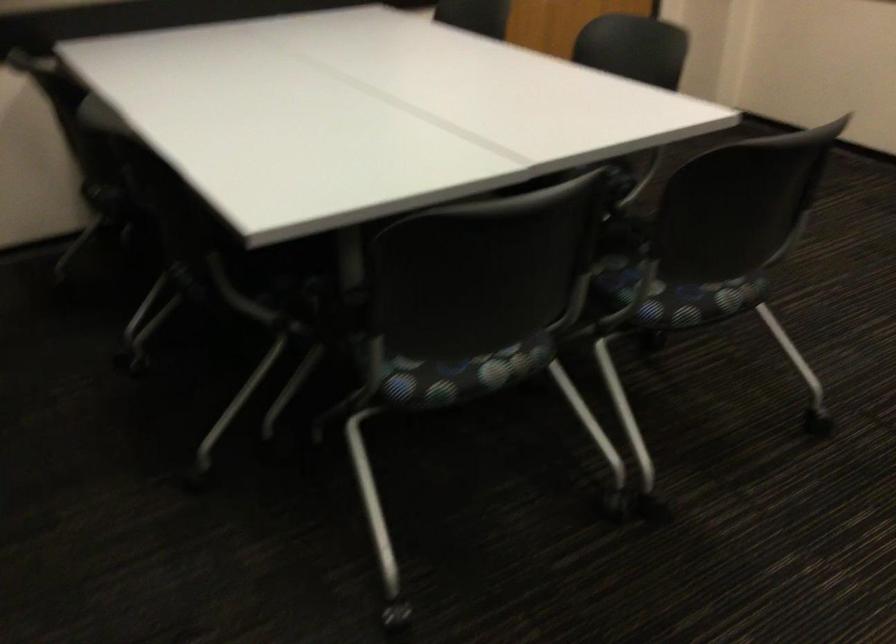
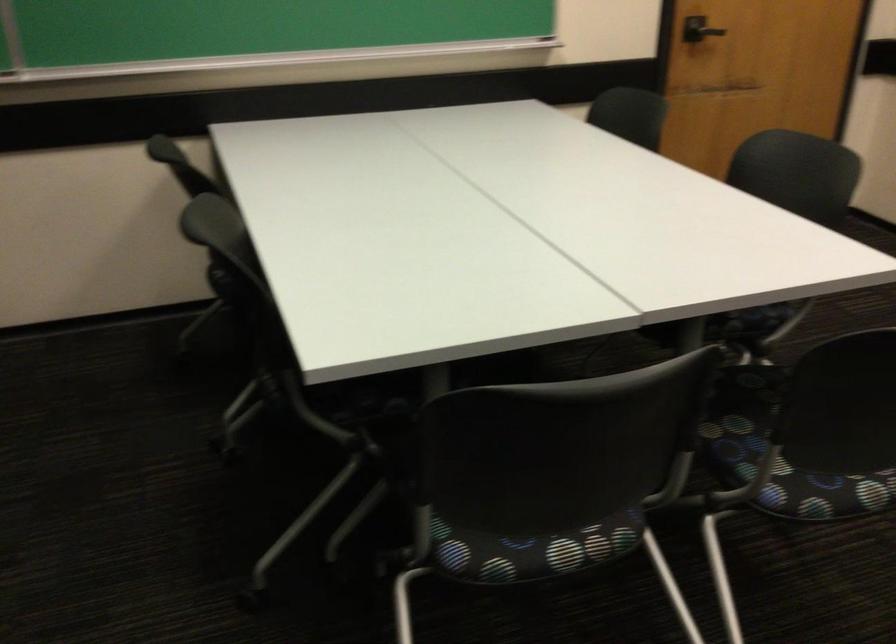
In the second image, find the point that corresponds to (x=300, y=290) in the first image.

(376, 413)